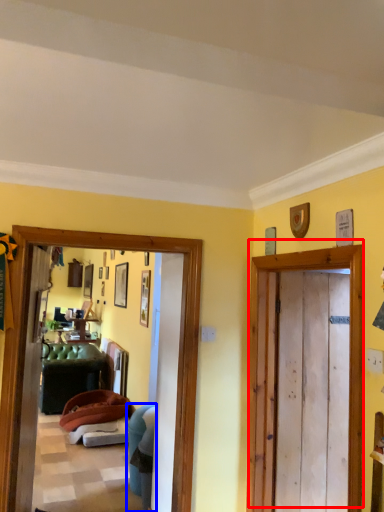
Question: Which object is closer to the camera taking this photo, door (highlighted by a red box) or chair (highlighted by a blue box)?

Choices:
 (A) door
 (B) chair

Answer: (A)